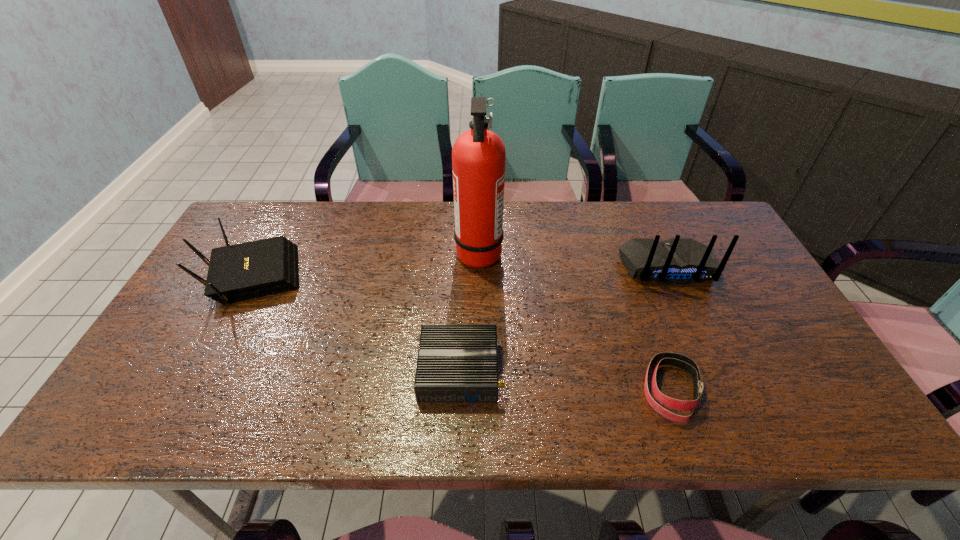
This screenshot has height=540, width=960. Find the location of `free location that satisfies the following two spatial constraints: 1. on the back of the tallest router; 2. on the back panel of the second shortest object`. free location that satisfies the following two spatial constraints: 1. on the back of the tallest router; 2. on the back panel of the second shortest object is located at coordinates (713, 370).

What are the coordinates of `free space that satisfies the following two spatial constraints: 1. on the back of the rightmost router; 2. on the back panel of the shortest router` in the screenshot? It's located at (713, 370).

At what (x,y) coordinates should I click in order to perform the action: click on vacant point that satisfies the following two spatial constraints: 1. on the front side of the dog collar; 2. on the left side of the second tallest router. Please return your answer as a coordinate pair (x, y). The height and width of the screenshot is (540, 960). Looking at the image, I should click on (191, 389).

The height and width of the screenshot is (540, 960). What are the coordinates of `vacant area in the image that satisfies the following two spatial constraints: 1. on the back of the tallest router; 2. on the back panel of the second shortest object` in the screenshot? It's located at (713, 370).